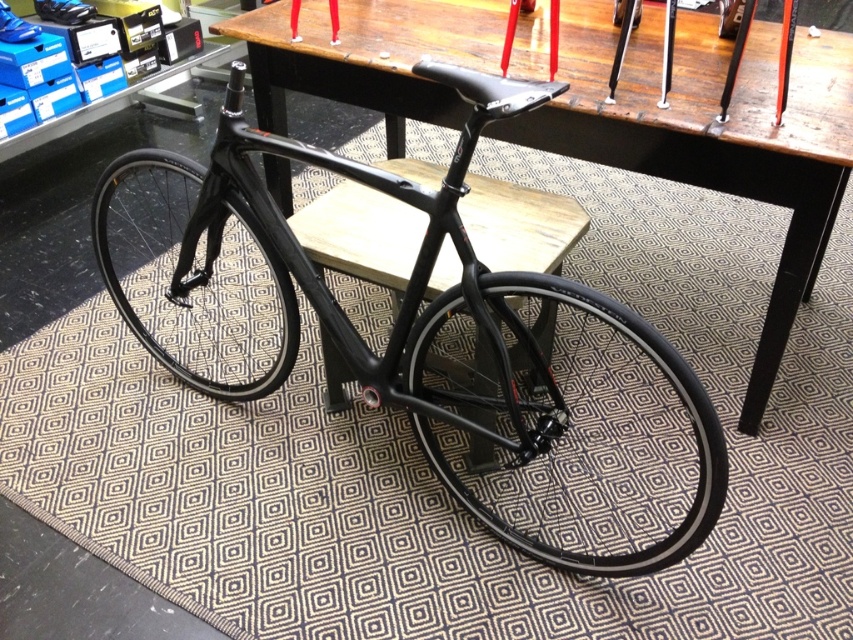
What do you see at coordinates (428, 342) in the screenshot?
I see `black matte bicycle at center` at bounding box center [428, 342].

Who is more distant from viewer, (x=270, y=372) or (x=276, y=52)?

The point (x=276, y=52) is more distant.

Does point (500, 468) lie in front of point (811, 145)?

No, it is not.

In order to click on black matte bicycle at center in this screenshot , I will do `click(428, 342)`.